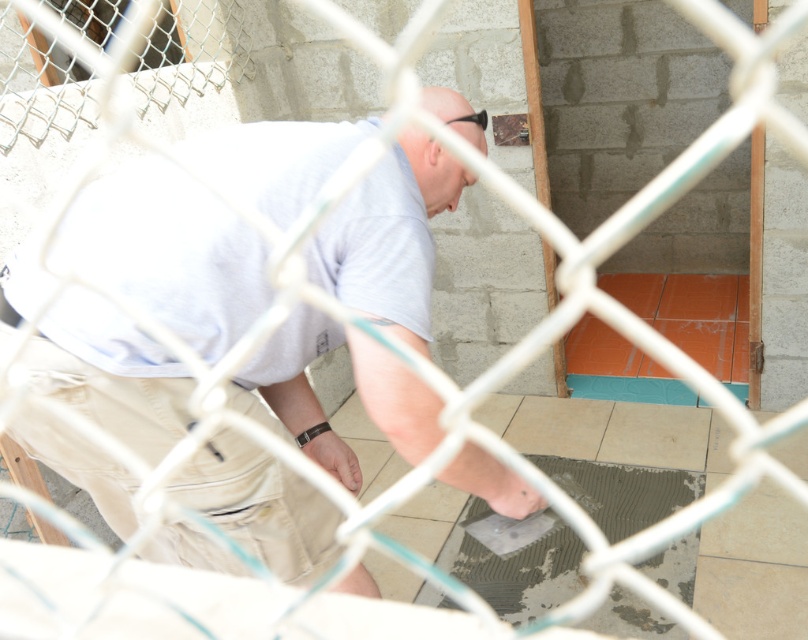
You are an inspector checking the construction site. You notice the light gray shirt at center and the beige ceramic tile at center. Which object is positioned higher in the image?

The light gray shirt at center is located above the beige ceramic tile at center, so it is positioned higher in the image.

You are a delivery person with a box that is 1.5 meters long. You need to place the box on the floor in the room where the light gray shirt at center and beige ceramic tile at center are located. Can you fit the box horizontally between these two objects without overlapping them?

The distance between the light gray shirt at center and beige ceramic tile at center is 1.65 meters. Since the box is 1.5 meters long, it can fit horizontally between them as there is enough space.